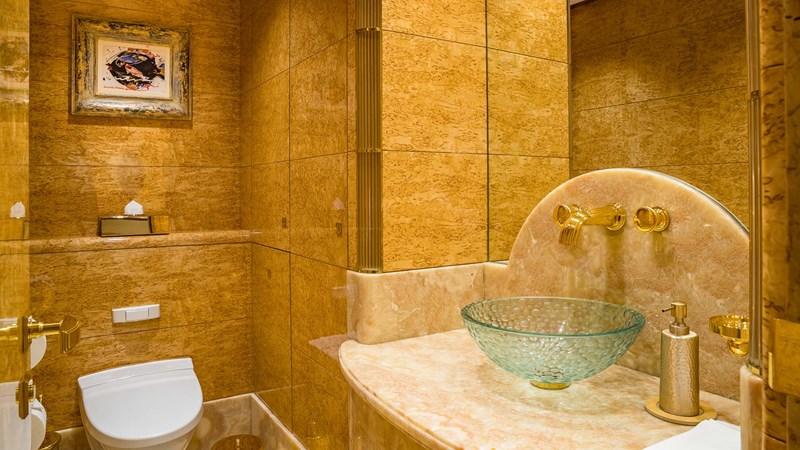
The width and height of the screenshot is (800, 450). I want to click on glass bowl, so click(x=560, y=341).